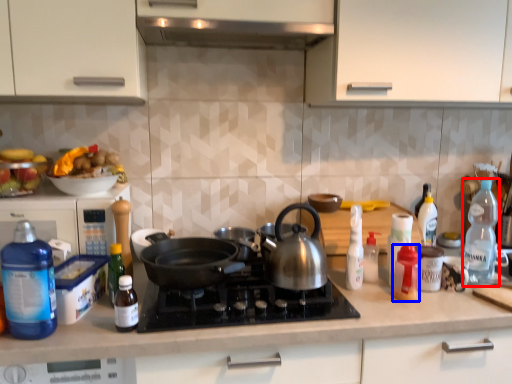
Question: Among these objects, which one is nearest to the camera, bottle (highlighted by a red box) or bottle (highlighted by a blue box)?

Choices:
 (A) bottle
 (B) bottle

Answer: (B)